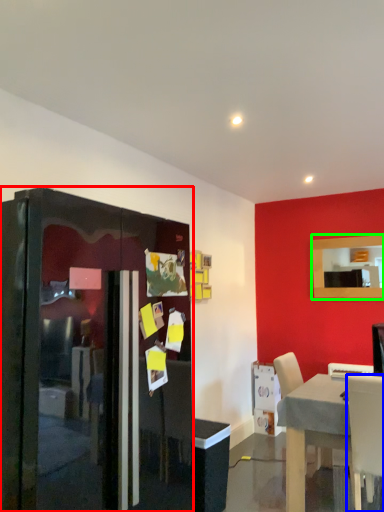
Question: Estimate the real-world distances between objects in this image. Which object is farther from fridge (highlighted by a red box), chair (highlighted by a blue box) or mirror (highlighted by a green box)?

Choices:
 (A) chair
 (B) mirror

Answer: (B)